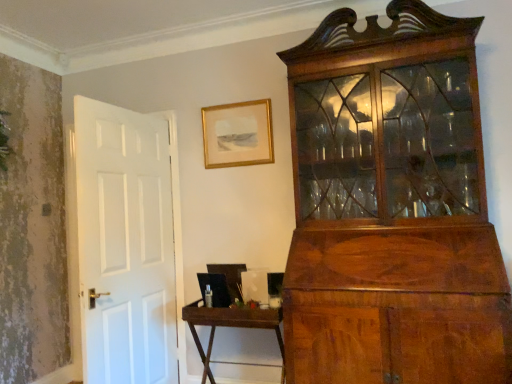
Question: Is brown wooden table at center aimed at gold/glass picture frame at upper center?

Choices:
 (A) yes
 (B) no

Answer: (B)

Question: Is the position of brown wooden table at center more distant than that of gold/glass picture frame at upper center?

Choices:
 (A) no
 (B) yes

Answer: (A)

Question: From a real-world perspective, is brown wooden table at center positioned over gold/glass picture frame at upper center based on gravity?

Choices:
 (A) yes
 (B) no

Answer: (B)

Question: From the image's perspective, is brown wooden table at center on gold/glass picture frame at upper center?

Choices:
 (A) no
 (B) yes

Answer: (A)

Question: Is brown wooden table at center directly adjacent to gold/glass picture frame at upper center?

Choices:
 (A) no
 (B) yes

Answer: (A)

Question: From a real-world perspective, is brown wooden table at center below gold/glass picture frame at upper center?

Choices:
 (A) yes
 (B) no

Answer: (A)

Question: Considering the relative positions of gold/glass picture frame at upper center and brown wooden table at center in the image provided, is gold/glass picture frame at upper center to the right of brown wooden table at center from the viewer's perspective?

Choices:
 (A) yes
 (B) no

Answer: (B)

Question: Is gold/glass picture frame at upper center oriented away from brown wooden table at center?

Choices:
 (A) yes
 (B) no

Answer: (B)

Question: Is gold/glass picture frame at upper center further to camera compared to brown wooden table at center?

Choices:
 (A) yes
 (B) no

Answer: (A)

Question: Is gold/glass picture frame at upper center positioned far away from brown wooden table at center?

Choices:
 (A) yes
 (B) no

Answer: (A)

Question: Does gold/glass picture frame at upper center have a greater height compared to brown wooden table at center?

Choices:
 (A) yes
 (B) no

Answer: (B)

Question: Is gold/glass picture frame at upper center next to brown wooden table at center?

Choices:
 (A) no
 (B) yes

Answer: (A)

Question: Is brown wooden table at center inside the boundaries of gold/glass picture frame at upper center, or outside?

Choices:
 (A) inside
 (B) outside

Answer: (B)